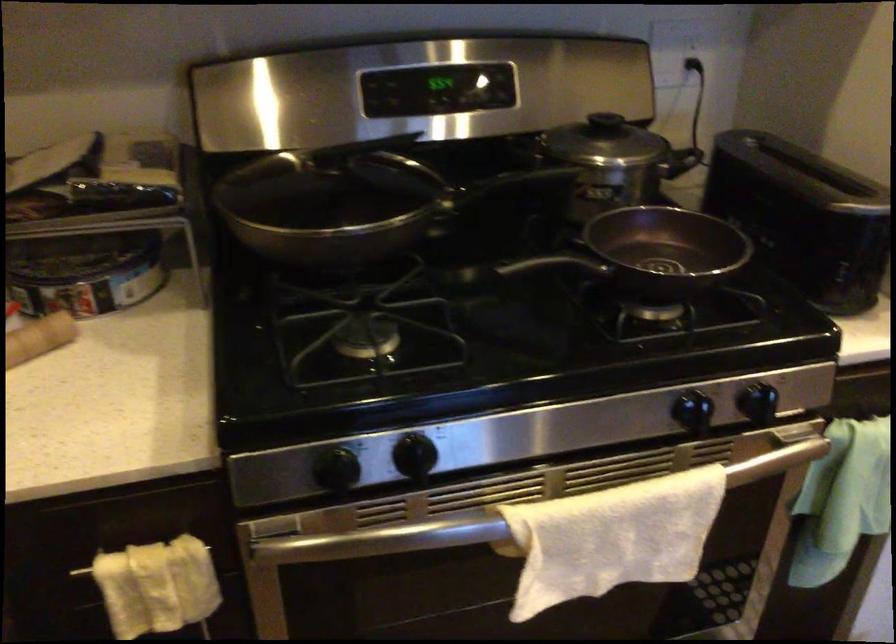
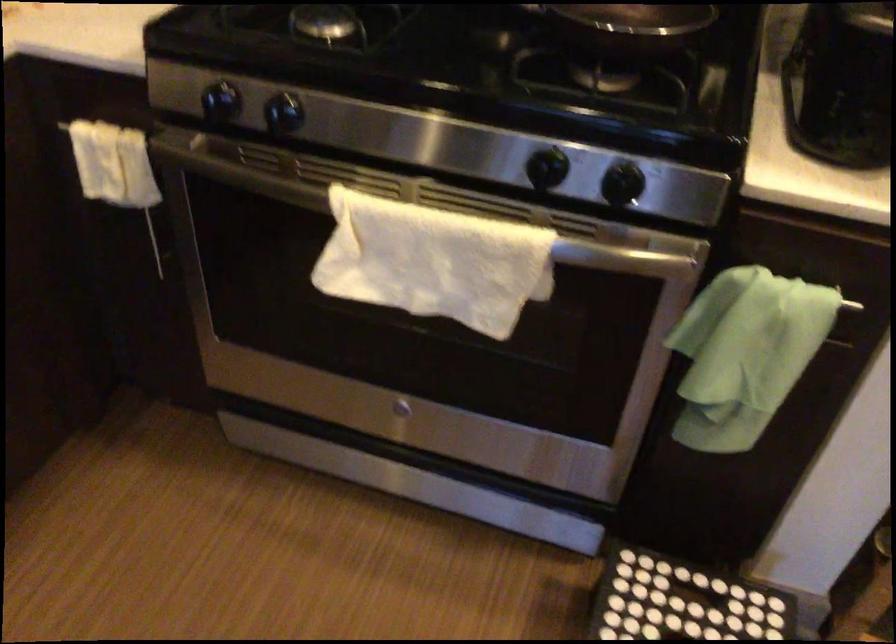
Locate, in the second image, the point that corresponds to pixel 769 462 in the first image.

(618, 257)